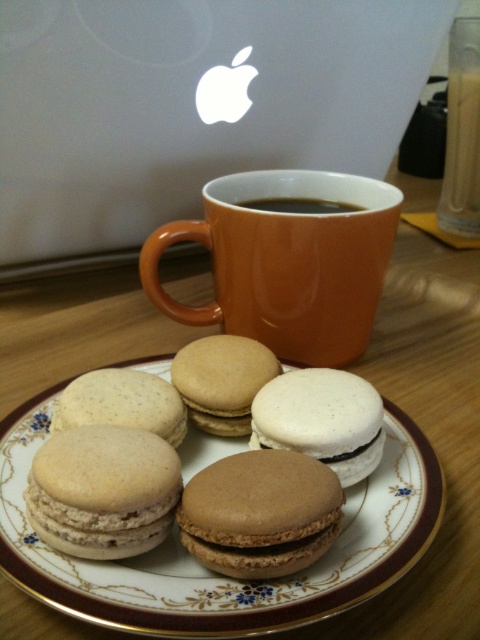
Question: Is matte brown macarons at center above orange ceramic mug at upper center?

Choices:
 (A) no
 (B) yes

Answer: (A)

Question: From the image, what is the correct spatial relationship of white matte macaron at center in relation to translucent glass at upper right?

Choices:
 (A) above
 (B) below

Answer: (B)

Question: Among these objects, which one is farthest from the camera?

Choices:
 (A) white matte macaron at center
 (B) matte beige macaron at center

Answer: (B)

Question: Can you confirm if matte brown macarons at center is positioned below matte beige macaron at center?

Choices:
 (A) no
 (B) yes

Answer: (B)

Question: Based on their relative distances, which object is farther from the orange ceramic mug at upper center?

Choices:
 (A) translucent glass at upper right
 (B) brown matte macaron at center
 (C) white matte macaron at center

Answer: (A)

Question: Which of these objects is positioned farthest from the matte beige macaron at center?

Choices:
 (A) translucent glass at upper right
 (B) brown matte coffee at upper center
 (C) brown matte macaron at center
 (D) white matte macaron at center

Answer: (A)